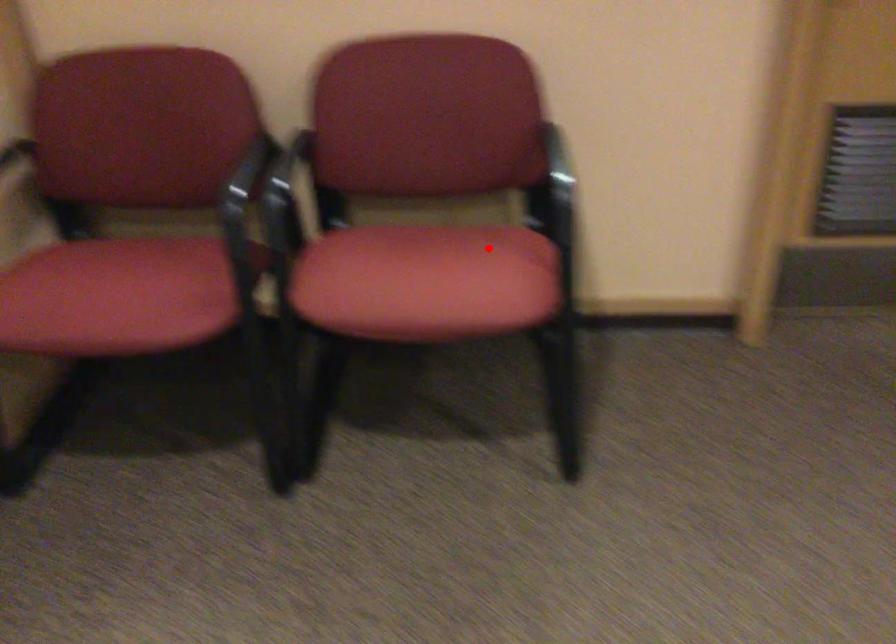
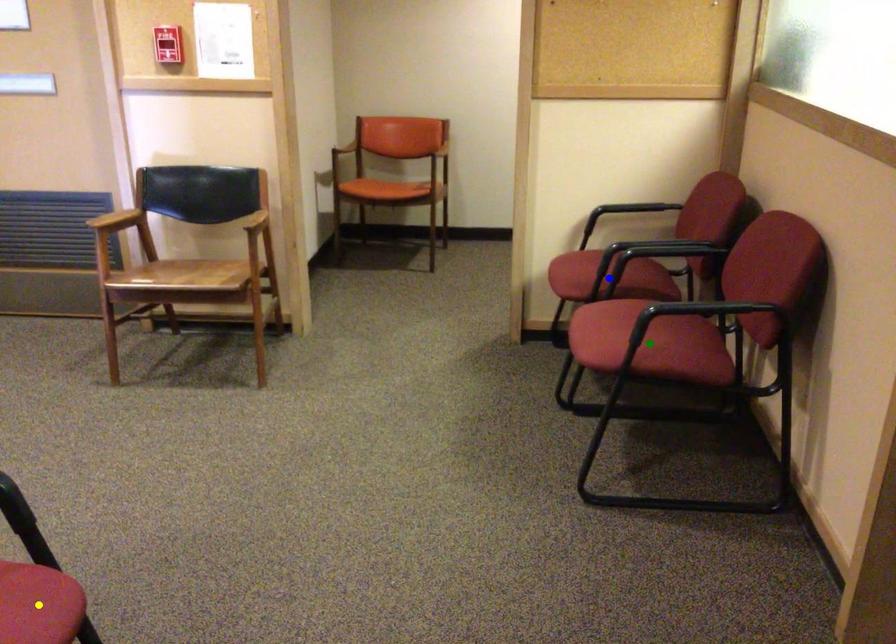
Question: I am providing you with two images of the same scene from different viewpoints. A red point is marked on the first image. You are given multiple points on the second image. Which spot in image 2 lines up with the point in image 1?

Choices:
 (A) blue point
 (B) yellow point
 (C) green point

Answer: (C)